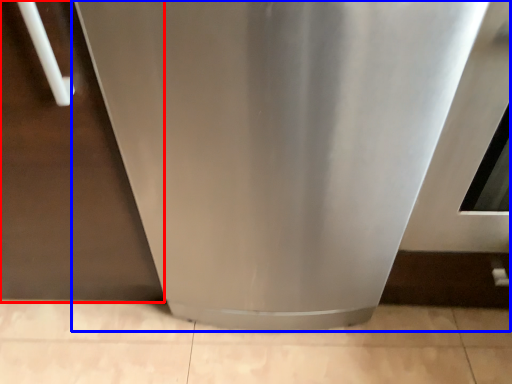
Question: Which of the following is the farthest to the observer, door (highlighted by a red box) or home appliance (highlighted by a blue box)?

Choices:
 (A) door
 (B) home appliance

Answer: (A)